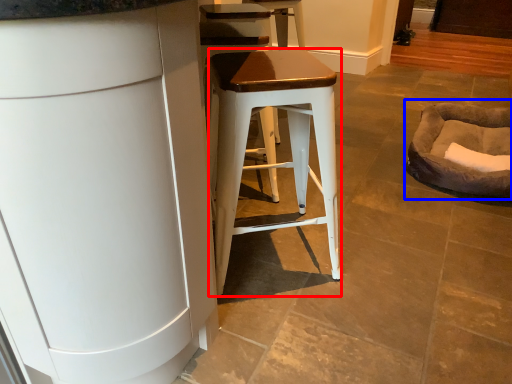
Question: Which object appears farthest to the camera in this image, stool (highlighted by a red box) or bean bag chair (highlighted by a blue box)?

Choices:
 (A) stool
 (B) bean bag chair

Answer: (B)